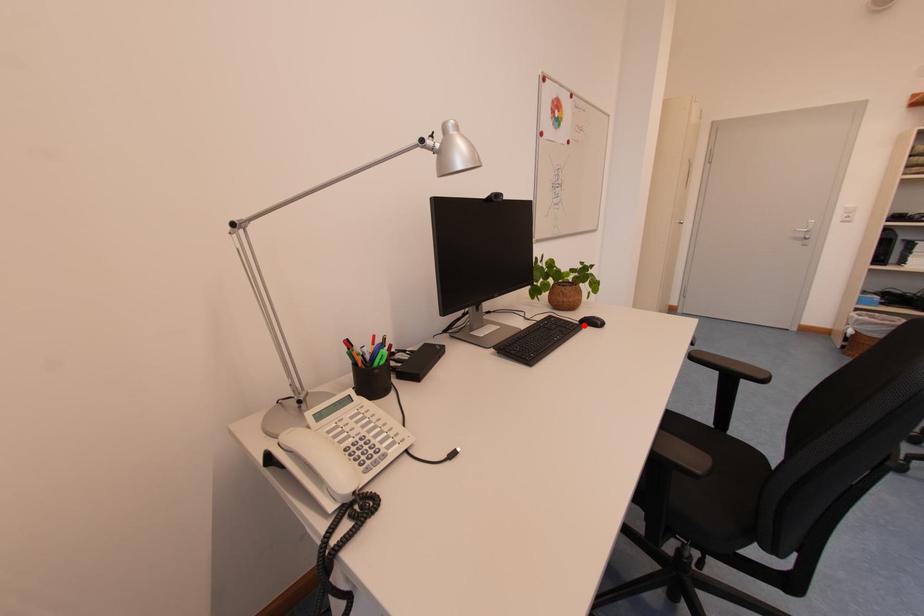
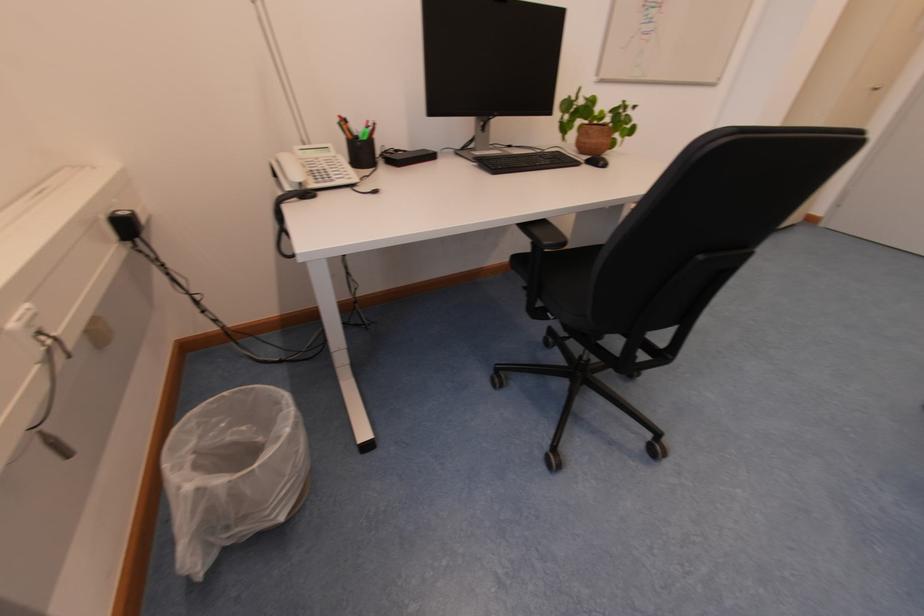
The point at the highlighted location is marked in the first image. Where is the corresponding point in the second image?

(590, 164)